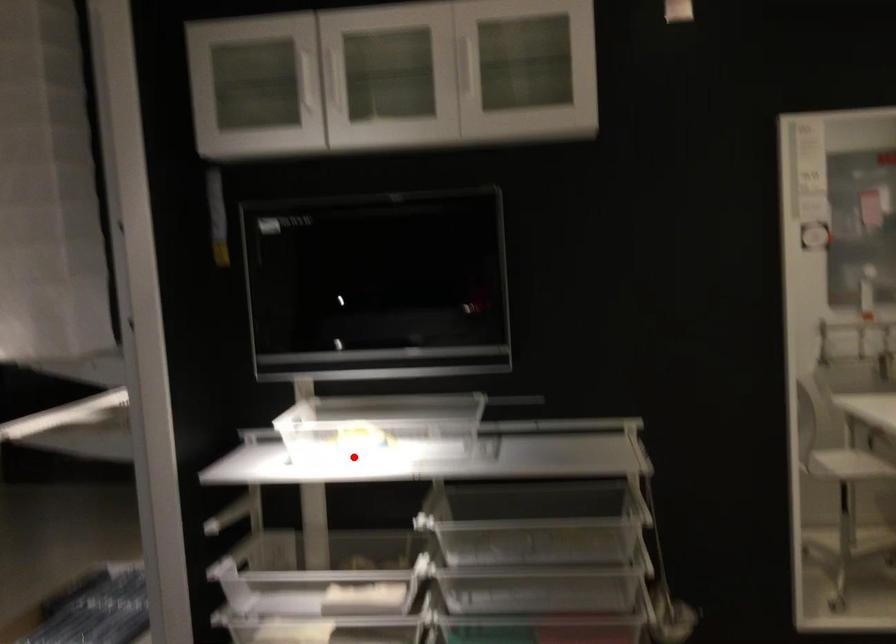
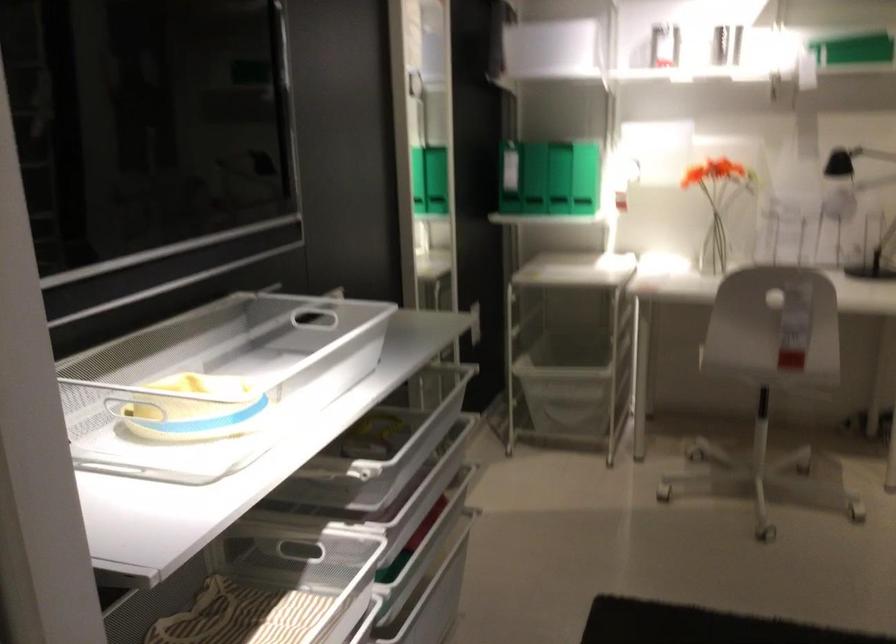
Question: A red point is marked in image1. In image2, is the corresponding 3D point closer to the camera or farther? Reply with the corresponding letter.

Choices:
 (A) The corresponding 3D point is closer.
 (B) The corresponding 3D point is farther.

Answer: (A)